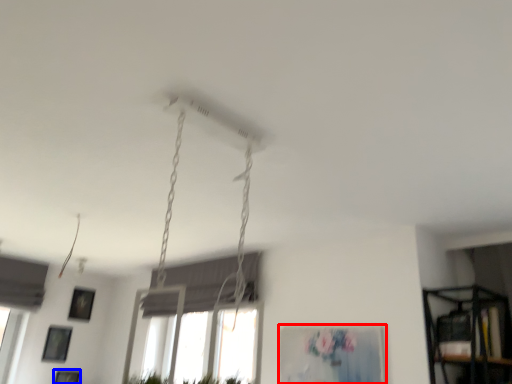
Question: Which point is further to the camera, picture frame (highlighted by a red box) or picture frame (highlighted by a blue box)?

Choices:
 (A) picture frame
 (B) picture frame

Answer: (B)